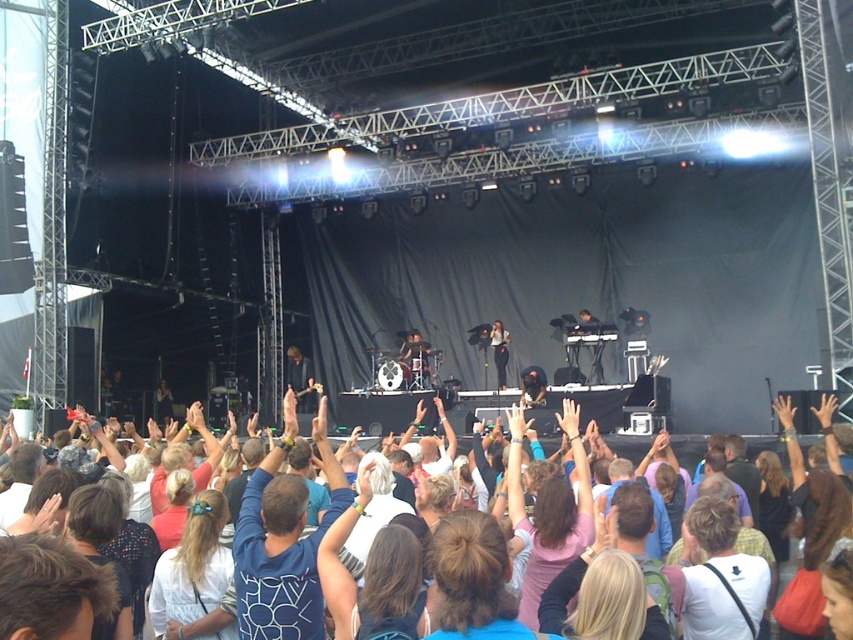
Question: Which is nearer to the white cotton crowd at center?

Choices:
 (A) dark blue shirt at center
 (B) matte black dress at center

Answer: (A)

Question: Which of the following is the closest to the observer?

Choices:
 (A) (508, 340)
 (B) (834, 470)
 (C) (310, 380)

Answer: (B)

Question: Does white cotton crowd at center have a greater width compared to matte black dress at center?

Choices:
 (A) yes
 (B) no

Answer: (A)

Question: Is white cotton crowd at center smaller than dark blue shirt at center?

Choices:
 (A) yes
 (B) no

Answer: (B)

Question: Does dark blue shirt at center appear under matte black dress at center?

Choices:
 (A) no
 (B) yes

Answer: (B)

Question: Among these objects, which one is farthest from the camera?

Choices:
 (A) white cotton crowd at center
 (B) dark blue shirt at center
 (C) matte black dress at center

Answer: (B)